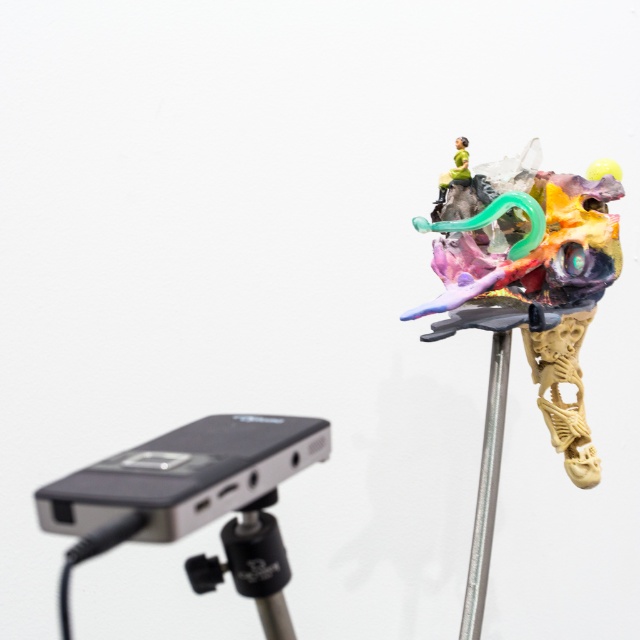
You are a photographer trying to focus your camera on the sculpture. The camera can only focus on objects at a certain distance. If you have to choose between focusing on point A at point [237,572] and point B at point [496,353], which point should you select to ensure the sculpture is in focus?

You should select point A at point [237,572] because it is closer to the camera than point B at point [496,353], making it easier to focus.